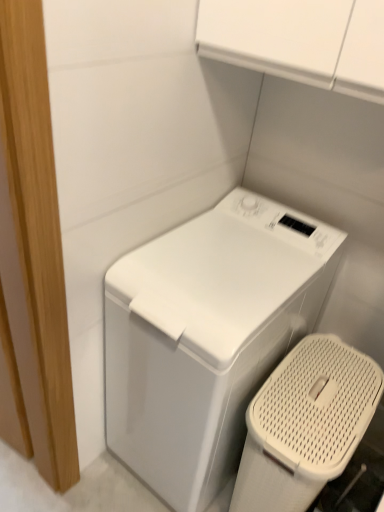
What do you see at coordinates (206, 337) in the screenshot?
I see `white glossy washing machine at center` at bounding box center [206, 337].

In the scene shown: In order to face white glossy washing machine at center, should I rotate leftwards or rightwards?

Rotate your view right by about 2.774°.

Find the location of a particular element. This screenshot has height=512, width=384. white glossy washing machine at center is located at coordinates (206, 337).

The image size is (384, 512). What do you see at coordinates (305, 424) in the screenshot? I see `white mesh laundry basket at lower right` at bounding box center [305, 424].

In order to click on white mesh laundry basket at lower right in this screenshot , I will do `click(305, 424)`.

Find the location of a particular element. The height and width of the screenshot is (512, 384). white glossy washing machine at center is located at coordinates (206, 337).

Can you confirm if white mesh laundry basket at lower right is positioned to the right of white glossy washing machine at center?

Indeed, white mesh laundry basket at lower right is positioned on the right side of white glossy washing machine at center.

Between white mesh laundry basket at lower right and white glossy washing machine at center, which one is positioned in front?

white glossy washing machine at center is in front.

Is point (249, 431) closer or farther from the camera than point (260, 233)?

Point (249, 431) is positioned closer to the camera compared to point (260, 233).

From the image's perspective, is white mesh laundry basket at lower right under white glossy washing machine at center?

Yes, from the image's perspective, white mesh laundry basket at lower right is below white glossy washing machine at center.

From a real-world perspective, is white mesh laundry basket at lower right on top of white glossy washing machine at center?

No, from a real-world perspective, white mesh laundry basket at lower right is not on top of white glossy washing machine at center.

Is white mesh laundry basket at lower right wider or thinner than white glossy washing machine at center?

white mesh laundry basket at lower right is thinner than white glossy washing machine at center.

Who is taller, white mesh laundry basket at lower right or white glossy washing machine at center?

white glossy washing machine at center is taller.

Which of these two, white mesh laundry basket at lower right or white glossy washing machine at center, is bigger?

Bigger between the two is white glossy washing machine at center.

In the scene shown: Is white mesh laundry basket at lower right outside of white glossy washing machine at center?

white mesh laundry basket at lower right is positioned outside white glossy washing machine at center.

Is white mesh laundry basket at lower right not close to white glossy washing machine at center?

They are positioned close to each other.

Consider the image. Is white mesh laundry basket at lower right oriented away from white glossy washing machine at center?

No.

How many degrees apart are the facing directions of white mesh laundry basket at lower right and white glossy washing machine at center?

white mesh laundry basket at lower right and white glossy washing machine at center are facing 0.101 degrees away from each other.

How far apart are white mesh laundry basket at lower right and white glossy washing machine at center?

white mesh laundry basket at lower right is 22.81 centimeters away from white glossy washing machine at center.

Identify the location of appliance behind the white glossy washing machine at center. Image resolution: width=384 pixels, height=512 pixels. [305, 424].

Is white glossy washing machine at center at the left side of white mesh laundry basket at lower right?

Yes.

Is white glossy washing machine at center positioned in front of white mesh laundry basket at lower right?

Yes, it is in front of white mesh laundry basket at lower right.

Which is farther, (x=119, y=422) or (x=339, y=443)?

The point (x=119, y=422) is more distant.

From the image's perspective, does white glossy washing machine at center appear lower than white mesh laundry basket at lower right?

Incorrect, from the image's perspective, white glossy washing machine at center is higher than white mesh laundry basket at lower right.

From a real-world perspective, is white glossy washing machine at center on top of white mesh laundry basket at lower right?

Yes, from a real-world perspective, white glossy washing machine at center is on top of white mesh laundry basket at lower right.

Does white glossy washing machine at center have a lesser width compared to white mesh laundry basket at lower right?

No, white glossy washing machine at center is not thinner than white mesh laundry basket at lower right.

Is white glossy washing machine at center shorter than white mesh laundry basket at lower right?

In fact, white glossy washing machine at center may be taller than white mesh laundry basket at lower right.

Considering the sizes of objects white glossy washing machine at center and white mesh laundry basket at lower right in the image provided, who is smaller, white glossy washing machine at center or white mesh laundry basket at lower right?

white mesh laundry basket at lower right.

Would you say white glossy washing machine at center contains white mesh laundry basket at lower right?

No, white glossy washing machine at center does not contain white mesh laundry basket at lower right.

Does white glossy washing machine at center touch white mesh laundry basket at lower right?

No, white glossy washing machine at center is not beside white mesh laundry basket at lower right.

Based on the photo, is white glossy washing machine at center oriented towards white mesh laundry basket at lower right?

No, white glossy washing machine at center does not turn towards white mesh laundry basket at lower right.

How many degrees apart are the facing directions of white glossy washing machine at center and white mesh laundry basket at lower right?

white glossy washing machine at center and white mesh laundry basket at lower right are facing 0.101 degrees away from each other.

How distant is white glossy washing machine at center from white mesh laundry basket at lower right?

white glossy washing machine at center is 8.98 inches away from white mesh laundry basket at lower right.

What are the coordinates of `washing machine on the left of the white mesh laundry basket at lower right` in the screenshot? It's located at (206, 337).

You are a GUI agent. You are given a task and a screenshot of the screen. Output one action in this format:
    pyautogui.click(x=<x>, y=<y>)
    Task: Click on the washing machine that appears on the left of white mesh laundry basket at lower right
    
    Given the screenshot: What is the action you would take?
    pyautogui.click(x=206, y=337)

Where is `washing machine that is above the white mesh laundry basket at lower right (from the image's perspective)`? washing machine that is above the white mesh laundry basket at lower right (from the image's perspective) is located at coordinates (206, 337).